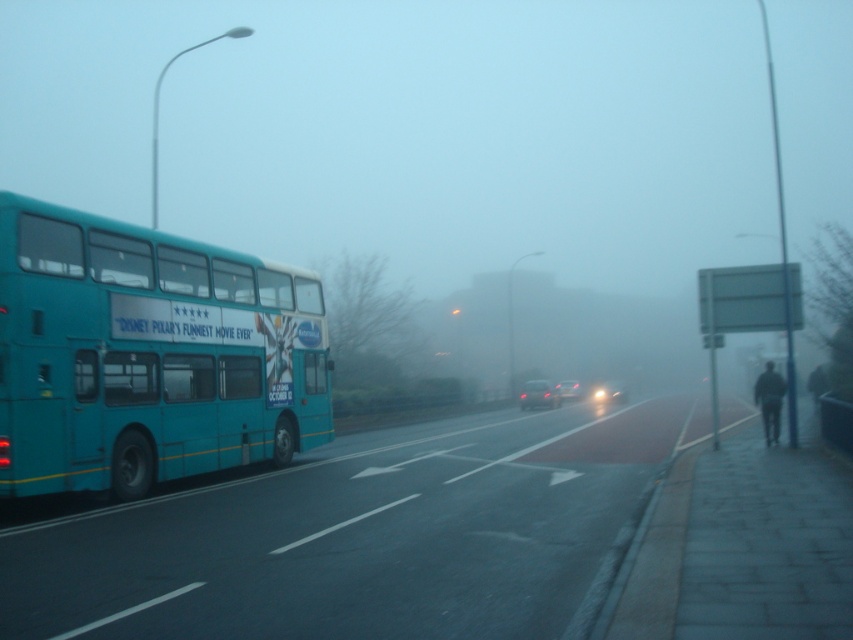
Can you confirm if teal matte/deckbus at left is positioned above white signboard at right?

Indeed, teal matte/deckbus at left is positioned over white signboard at right.

Does point (165, 384) lie in front of point (706, 312)?

Yes, it is.

Locate an element on the screen. teal matte/deckbus at left is located at coordinates (148, 355).